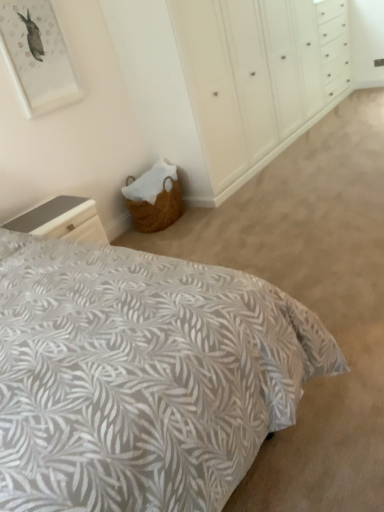
Question: Does smooth gray nightstand at lower left appear on the left side of woven basket at lower left?

Choices:
 (A) yes
 (B) no

Answer: (A)

Question: From a real-world perspective, does smooth gray nightstand at lower left sit lower than woven basket at lower left?

Choices:
 (A) no
 (B) yes

Answer: (B)

Question: Would you say woven basket at lower left is part of smooth gray nightstand at lower left's contents?

Choices:
 (A) no
 (B) yes

Answer: (A)

Question: Is smooth gray nightstand at lower left far from woven basket at lower left?

Choices:
 (A) yes
 (B) no

Answer: (A)

Question: Can you confirm if smooth gray nightstand at lower left is positioned to the right of woven basket at lower left?

Choices:
 (A) no
 (B) yes

Answer: (A)

Question: Does smooth gray nightstand at lower left lie behind woven basket at lower left?

Choices:
 (A) yes
 (B) no

Answer: (B)

Question: Considering the relative sizes of matte white picture frame at upper left and leaf-patterned fabric bed at lower left in the image provided, is matte white picture frame at upper left thinner than leaf-patterned fabric bed at lower left?

Choices:
 (A) yes
 (B) no

Answer: (A)

Question: Considering the relative positions of matte white picture frame at upper left and leaf-patterned fabric bed at lower left in the image provided, is matte white picture frame at upper left to the left of leaf-patterned fabric bed at lower left from the viewer's perspective?

Choices:
 (A) yes
 (B) no

Answer: (A)

Question: Is matte white picture frame at upper left aimed at leaf-patterned fabric bed at lower left?

Choices:
 (A) yes
 (B) no

Answer: (B)

Question: Is leaf-patterned fabric bed at lower left completely or partially inside matte white picture frame at upper left?

Choices:
 (A) yes
 (B) no

Answer: (B)

Question: From a real-world perspective, is matte white picture frame at upper left physically below leaf-patterned fabric bed at lower left?

Choices:
 (A) no
 (B) yes

Answer: (A)

Question: Is matte white picture frame at upper left wider than leaf-patterned fabric bed at lower left?

Choices:
 (A) yes
 (B) no

Answer: (B)

Question: Can you confirm if matte white picture frame at upper left is bigger than smooth gray nightstand at lower left?

Choices:
 (A) no
 (B) yes

Answer: (A)